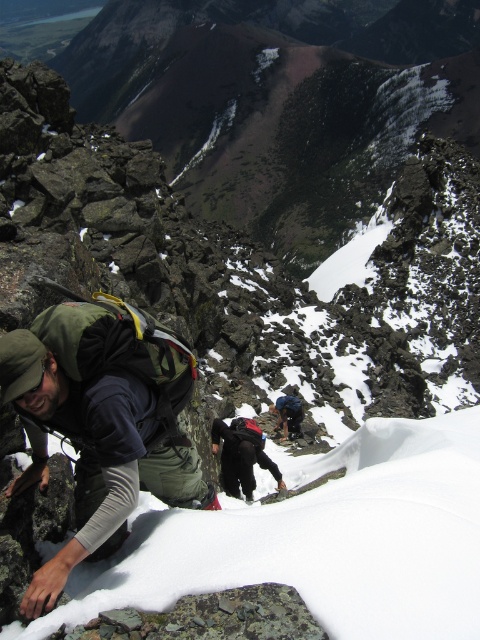
Question: Is green fabric backpack at left bigger than dark gray fabric backpack at center?

Choices:
 (A) yes
 (B) no

Answer: (A)

Question: Does green fabric backpack at left have a lesser width compared to dark blue ski suit at center?

Choices:
 (A) no
 (B) yes

Answer: (A)

Question: Estimate the real-world distances between objects in this image. Which object is closer to the green fabric backpack at left?

Choices:
 (A) dark gray fabric backpack at center
 (B) dark blue ski suit at center

Answer: (A)

Question: Which object is closer to the camera taking this photo?

Choices:
 (A) green fabric backpack at left
 (B) dark gray fabric backpack at center

Answer: (A)

Question: Does green fabric backpack at left have a larger size compared to dark gray fabric backpack at center?

Choices:
 (A) yes
 (B) no

Answer: (A)

Question: Which point is closer to the camera taking this photo?

Choices:
 (A) (245, 442)
 (B) (282, 400)
 (C) (74, 308)

Answer: (C)